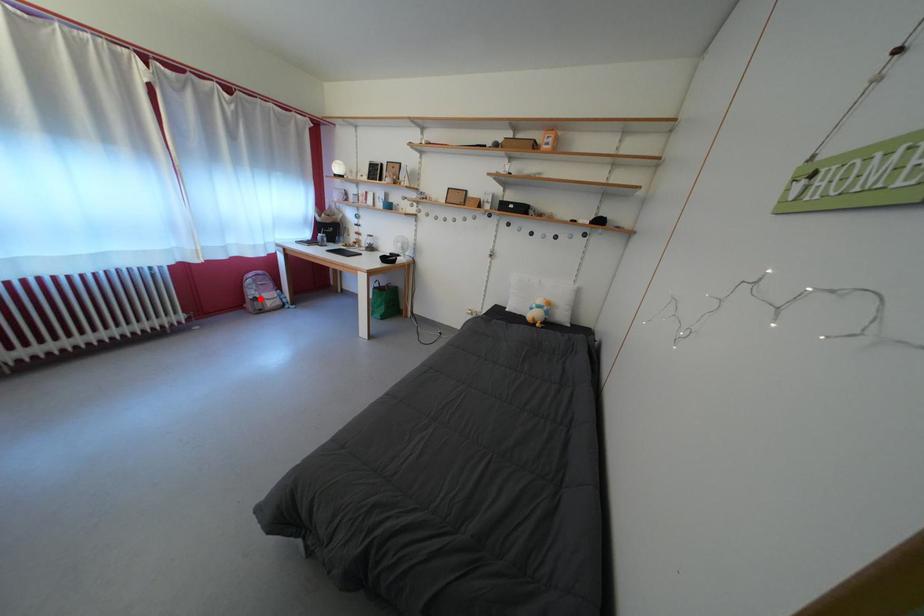
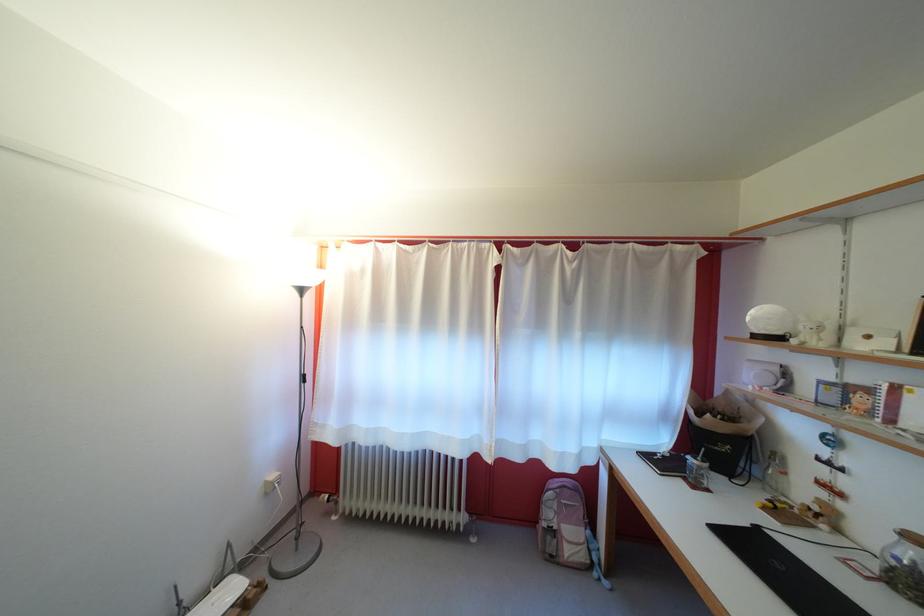
Question: I am providing you with two images of the same scene from different viewpoints. In image1, a red point is highlighted. Considering the same 3D point in image2, which of the following is correct?

Choices:
 (A) It is closer
 (B) It is farther

Answer: (B)